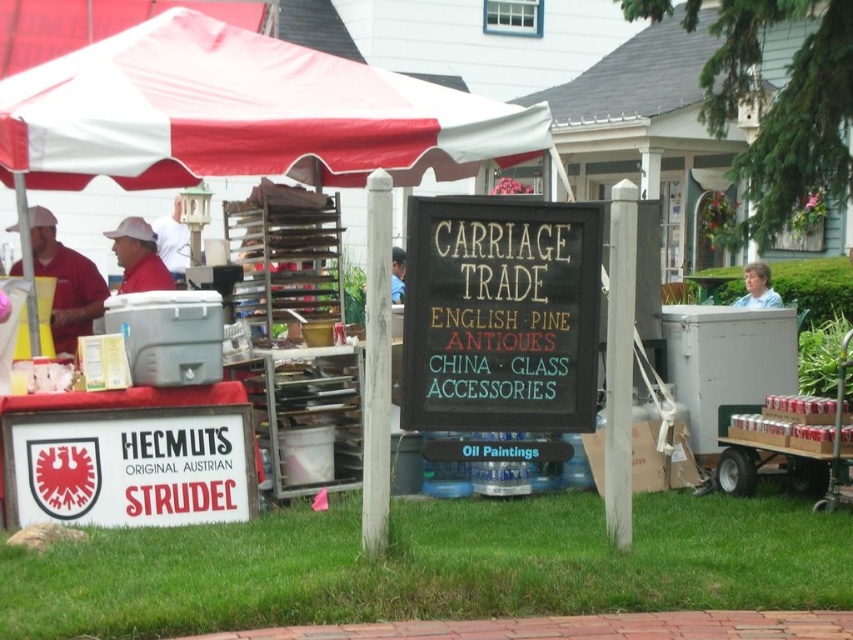
Can you confirm if black chalkboard sign at center is positioned above blue fabric shirt at center?

No.

How far apart are black chalkboard sign at center and blue fabric shirt at center?

black chalkboard sign at center is 4.13 feet away from blue fabric shirt at center.

Where is `black chalkboard sign at center`? The width and height of the screenshot is (853, 640). black chalkboard sign at center is located at coordinates (500, 314).

Between matte red shirt at left and blue fabric shirt at center, which one is positioned lower?

Positioned lower is matte red shirt at left.

What do you see at coordinates (138, 257) in the screenshot? I see `matte red shirt at left` at bounding box center [138, 257].

Is point (131, 234) farther from viewer compared to point (397, 264)?

No, it is not.

You are a GUI agent. You are given a task and a screenshot of the screen. Output one action in this format:
    pyautogui.click(x=<x>, y=<y>)
    Task: Click on the matte red shirt at left
    
    Given the screenshot: What is the action you would take?
    coord(138,257)

Is black chalkboard sign at center thinner than light blue shirt at right?

In fact, black chalkboard sign at center might be wider than light blue shirt at right.

Who is positioned more to the right, black chalkboard sign at center or light blue shirt at right?

light blue shirt at right

Where is `black chalkboard sign at center`? The height and width of the screenshot is (640, 853). black chalkboard sign at center is located at coordinates point(500,314).

Identify the location of black chalkboard sign at center. This screenshot has width=853, height=640. (500, 314).